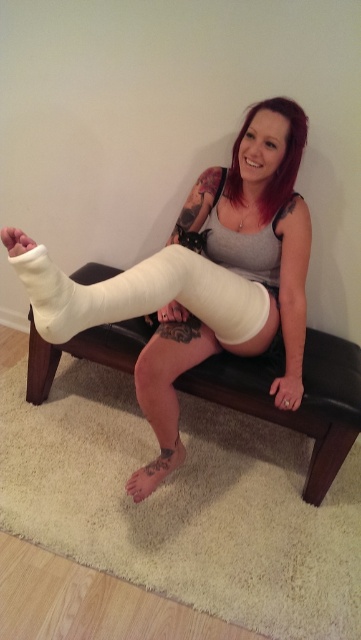
Image resolution: width=361 pixels, height=640 pixels. In order to click on white cast at center in this screenshot , I will do `click(202, 273)`.

Does white cast at center have a greater height compared to black matte tattoo at lower left?

Yes.

This screenshot has height=640, width=361. I want to click on white cast at center, so click(x=202, y=273).

Which is more to the left, white matte bandage at center or matte skin arm at lower center?

From the viewer's perspective, white matte bandage at center appears more on the left side.

Who is more distant from viewer, (54, 336) or (297, 253)?

Point (297, 253)

In order to click on white matte bandage at center in this screenshot , I will do 142,294.

Which is above, white matte bandage at center or black matte tattoo at lower left?

white matte bandage at center is above.

The image size is (361, 640). What are the coordinates of `white matte bandage at center` in the screenshot? It's located at coord(142,294).

Looking at this image, who is more forward, (189, 266) or (125, 484)?

Point (189, 266)

Locate an element on the screen. The width and height of the screenshot is (361, 640). white matte bandage at center is located at coordinates (142, 294).